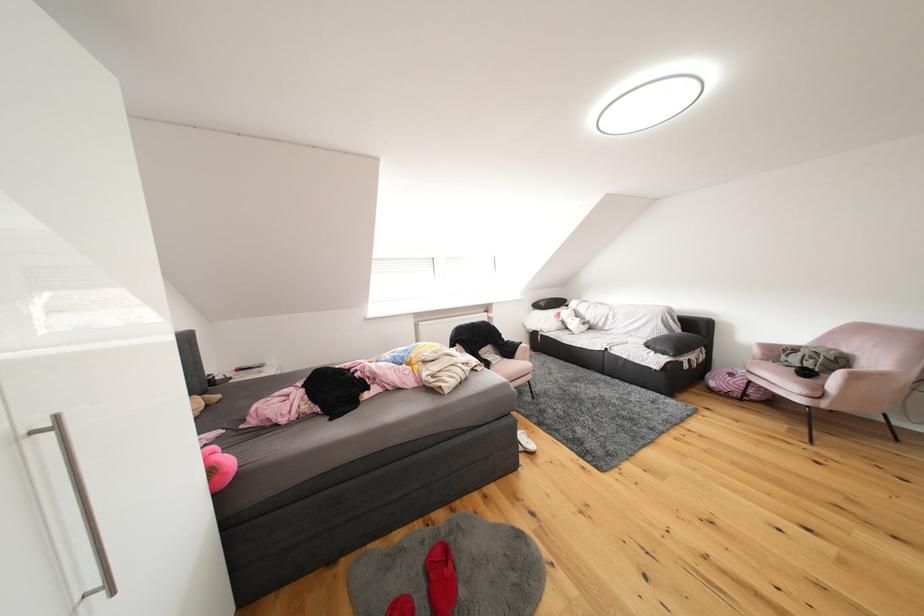
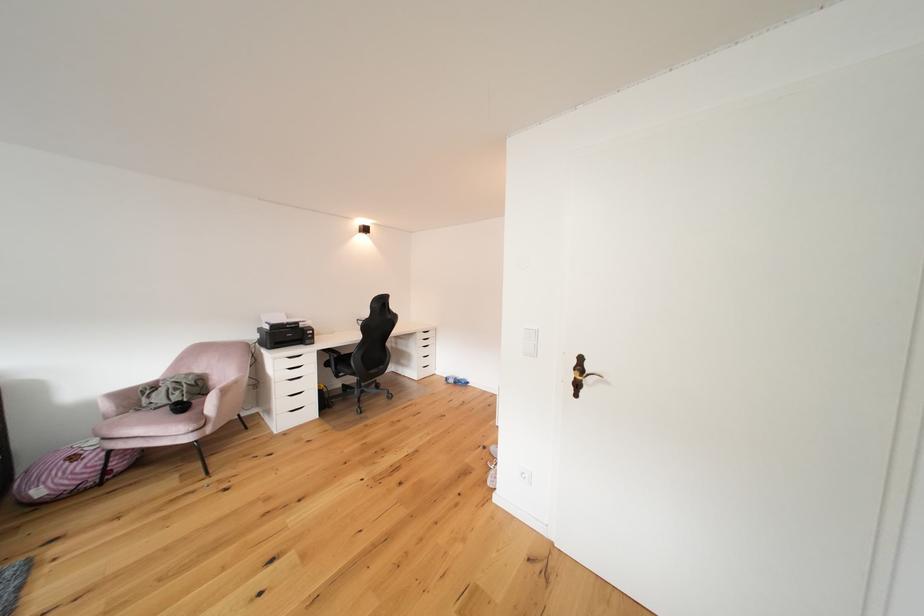
Where in the second image is the point corresponding to [856,354] from the first image?

(208, 374)